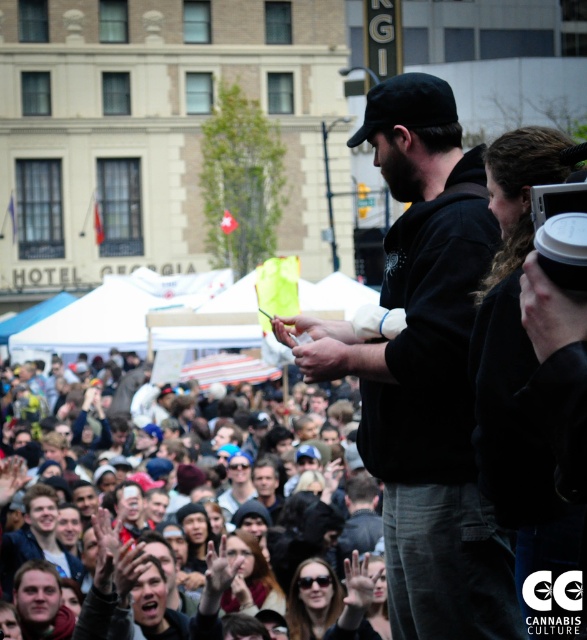
Between black matte jacket at center and light brown hair at center, which one is positioned lower?

light brown hair at center is below.

Identify the location of black matte jacket at center. This screenshot has width=587, height=640. (424, 371).

Locate an element on the screen. The width and height of the screenshot is (587, 640). black matte jacket at center is located at coordinates (424, 371).

Between matte black shirt at center and light brown hair at center, which one appears on the right side from the viewer's perspective?

Positioned to the right is light brown hair at center.

Can you confirm if matte black shirt at center is positioned to the left of light brown hair at center?

Yes, matte black shirt at center is to the left of light brown hair at center.

In the scene shown: Who is more forward, (48, 506) or (43, 564)?

Positioned in front is point (43, 564).

Image resolution: width=587 pixels, height=640 pixels. I want to click on matte black shirt at center, so click(x=35, y=540).

Does black matte jacket at center appear over blurred crowd at center?

Yes.

Is point (403, 90) closer to viewer compared to point (170, 612)?

Yes, point (403, 90) is in front of point (170, 612).

The image size is (587, 640). I want to click on black matte jacket at center, so click(x=424, y=371).